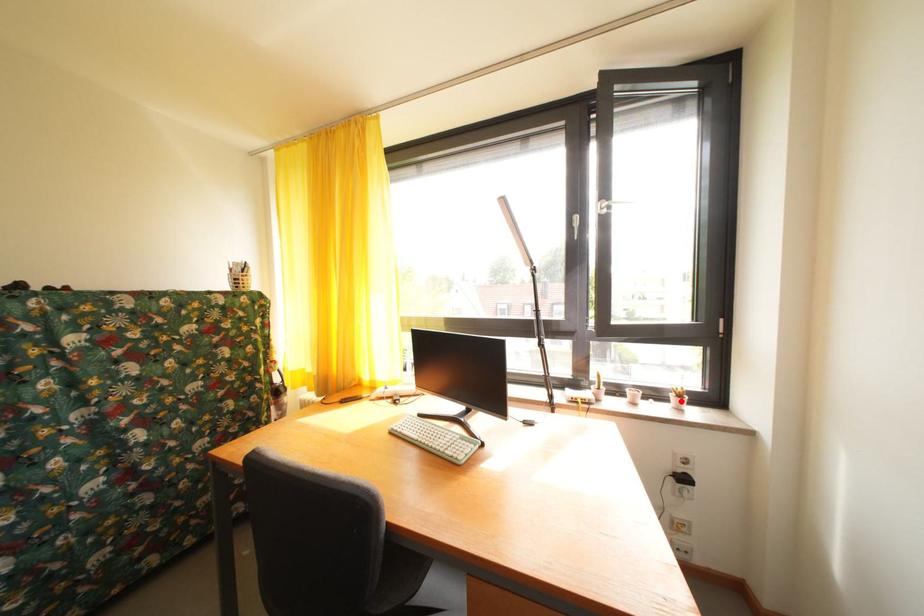
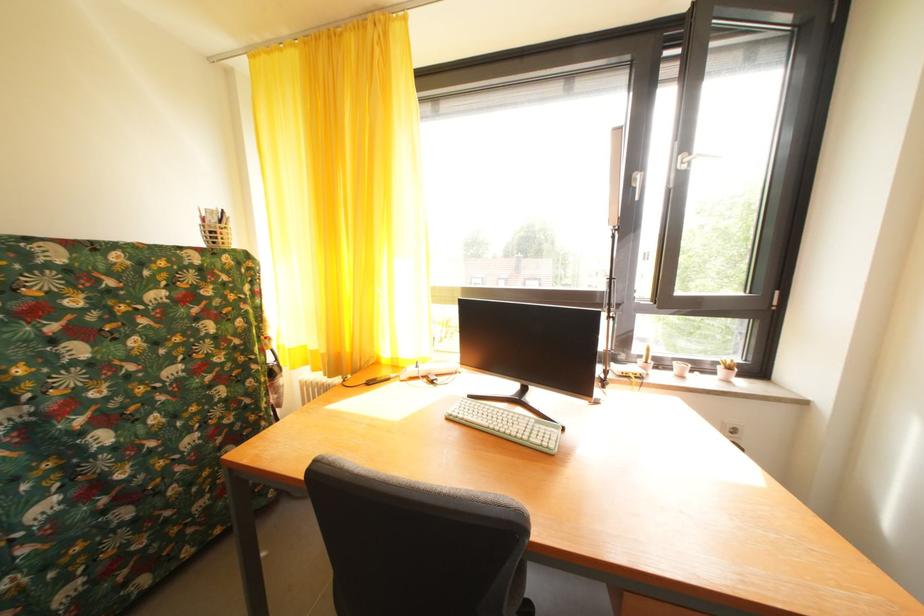
Find the pixel in the second image that matches the highlighted location in the first image.

(728, 374)